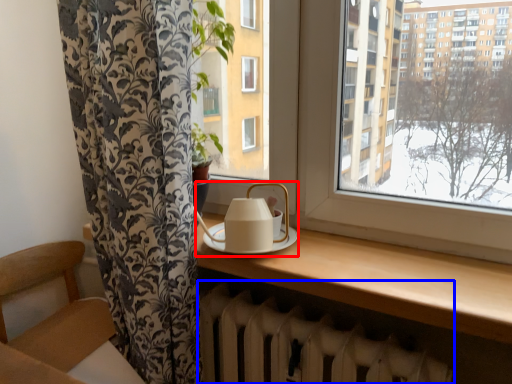
Question: Which point is further to the camera, tea set (highlighted by a red box) or radiator (highlighted by a blue box)?

Choices:
 (A) tea set
 (B) radiator

Answer: (A)